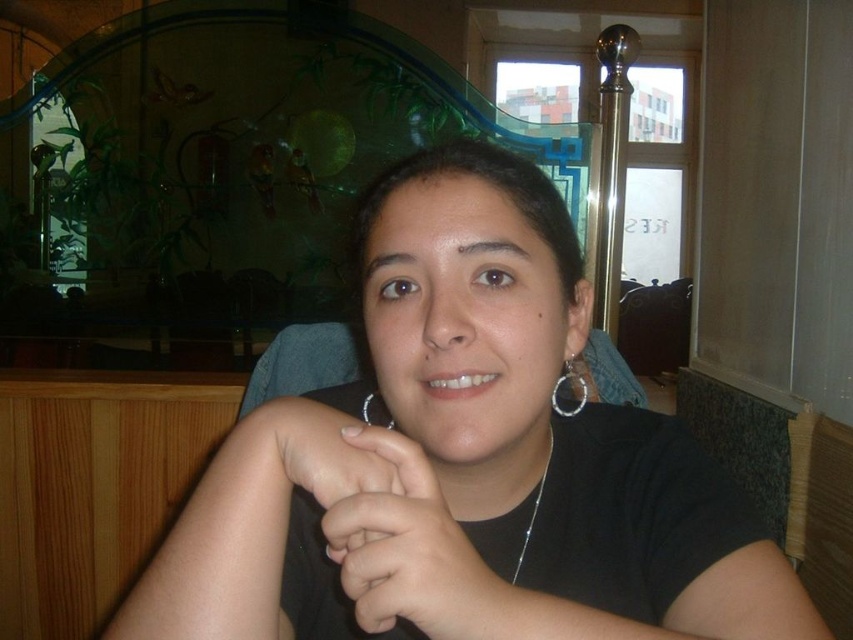
You are a GUI agent. You are given a task and a screenshot of the screen. Output one action in this format:
    pyautogui.click(x=<x>, y=<y>)
    Task: Click on the black matte hand at center
    
    Given the screenshot: What is the action you would take?
    pyautogui.click(x=413, y=552)

Between point (387, 483) and point (554, 412), which one is positioned behind?

The point (554, 412) is more distant.

The image size is (853, 640). In order to click on black matte hand at center in this screenshot , I will do `click(413, 552)`.

You are a GUI agent. You are given a task and a screenshot of the screen. Output one action in this format:
    pyautogui.click(x=<x>, y=<y>)
    Task: Click on the black matte hand at center
    The width and height of the screenshot is (853, 640).
    Given the screenshot: What is the action you would take?
    pyautogui.click(x=413, y=552)

Who is positioned more to the right, silver metallic hoop at center or silver metallic necklace at center?

Positioned to the right is silver metallic hoop at center.

Can you confirm if silver metallic hoop at center is positioned above silver metallic necklace at center?

Yes, silver metallic hoop at center is above silver metallic necklace at center.

Is point (576, 412) positioned behind point (531, 538)?

Yes, point (576, 412) is farther from viewer.

The width and height of the screenshot is (853, 640). I want to click on silver metallic hoop at center, so click(x=570, y=388).

Between black matte shirt at center and silver metallic hoop at center, which one is positioned higher?

silver metallic hoop at center

Does black matte shirt at center have a smaller size compared to silver metallic hoop at center?

Incorrect, black matte shirt at center is not smaller in size than silver metallic hoop at center.

Where is `black matte shirt at center`? The height and width of the screenshot is (640, 853). black matte shirt at center is located at coordinates (465, 461).